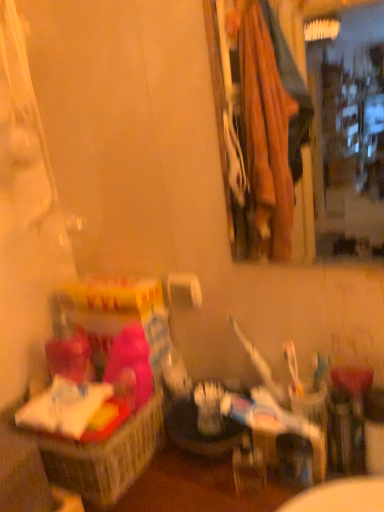
Image resolution: width=384 pixels, height=512 pixels. I want to click on white matte toilet paper at center, so click(184, 290).

Where is `wooden frame mirror at upper right`? The image size is (384, 512). wooden frame mirror at upper right is located at coordinates (332, 115).

Where is `pink fabric basket at left`? pink fabric basket at left is located at coordinates (104, 456).

Locate an element on the screen. mirror that is in front of the pink fabric basket at left is located at coordinates (332, 115).

Which is nearer, (40, 442) or (320, 99)?

Point (40, 442) is closer to the camera than point (320, 99).

From the image's perspective, which object appears higher, pink fabric basket at left or wooden frame mirror at upper right?

wooden frame mirror at upper right.

How different are the orientations of white matte toilet paper at center and wooden frame mirror at upper right in degrees?

The angular difference between white matte toilet paper at center and wooden frame mirror at upper right is 0.133 degrees.

From a real-world perspective, which is physically above, white matte toilet paper at center or wooden frame mirror at upper right?

wooden frame mirror at upper right, from a real-world perspective.

Is point (182, 281) closer or farther from the camera than point (342, 89)?

Point (182, 281).

Could you tell me if white matte toilet paper at center is facing wooden frame mirror at upper right?

No, white matte toilet paper at center is not oriented towards wooden frame mirror at upper right.

Is wooden frame mirror at upper right to the left or to the right of white matte toilet paper at center in the image?

In the image, wooden frame mirror at upper right appears on the right side of white matte toilet paper at center.

Which is behind, wooden frame mirror at upper right or white matte toilet paper at center?

white matte toilet paper at center is behind.

From the picture: Is wooden frame mirror at upper right wider than white matte toilet paper at center?

Indeed, wooden frame mirror at upper right has a greater width compared to white matte toilet paper at center.

Between point (336, 110) and point (172, 284), which one is positioned behind?

Positioned behind is point (336, 110).

How distant is wooden frame mirror at upper right from pink fabric basket at left?

The distance of wooden frame mirror at upper right from pink fabric basket at left is 5.26 meters.

Considering the relative sizes of wooden frame mirror at upper right and pink fabric basket at left in the image provided, is wooden frame mirror at upper right thinner than pink fabric basket at left?

Yes.

Who is taller, wooden frame mirror at upper right or pink fabric basket at left?

With more height is wooden frame mirror at upper right.

In the scene shown: Which is correct: wooden frame mirror at upper right is inside pink fabric basket at left, or outside of it?

The correct answer is: outside.

Is white matte toilet paper at center oriented away from pink fabric basket at left?

No.

How much distance is there between white matte toilet paper at center and pink fabric basket at left?

white matte toilet paper at center and pink fabric basket at left are 13.73 inches apart.

From the image's perspective, is white matte toilet paper at center above pink fabric basket at left?

Indeed, from the image's perspective, white matte toilet paper at center is shown above pink fabric basket at left.

Can you confirm if white matte toilet paper at center is positioned to the left of pink fabric basket at left?

No.

From the image's perspective, is pink fabric basket at left positioned above or below white matte toilet paper at center?

From the image's perspective, pink fabric basket at left appears below white matte toilet paper at center.

How many degrees apart are the facing directions of pink fabric basket at left and white matte toilet paper at center?

The angular difference between pink fabric basket at left and white matte toilet paper at center is 0.0997 degrees.

Is pink fabric basket at left taller than white matte toilet paper at center?

Indeed, pink fabric basket at left has a greater height compared to white matte toilet paper at center.

Would you say pink fabric basket at left is inside or outside white matte toilet paper at center?

pink fabric basket at left cannot be found inside white matte toilet paper at center.

Find the location of a particular element. Image resolution: width=384 pixels, height=512 pixels. mirror above the pink fabric basket at left (from a real-world perspective) is located at coordinates (332, 115).

This screenshot has height=512, width=384. What are the coordinates of `mirror in front of the white matte toilet paper at center` in the screenshot? It's located at (332, 115).

Estimate the real-world distances between objects in this image. Which object is closer to wooden frame mirror at upper right, pink fabric basket at left or white matte toilet paper at center?

Based on the image, white matte toilet paper at center appears to be nearer to wooden frame mirror at upper right.

Estimate the real-world distances between objects in this image. Which object is closer to pink fabric basket at left, white matte toilet paper at center or wooden frame mirror at upper right?

Based on the image, white matte toilet paper at center appears to be nearer to pink fabric basket at left.

Based on their spatial positions, is pink fabric basket at left or wooden frame mirror at upper right closer to white matte toilet paper at center?

pink fabric basket at left lies closer to white matte toilet paper at center than the other object.

Based on their spatial positions, is white matte toilet paper at center or pink fabric basket at left further from wooden frame mirror at upper right?

pink fabric basket at left lies further to wooden frame mirror at upper right than the other object.

When comparing their distances from white matte toilet paper at center, does wooden frame mirror at upper right or pink fabric basket at left seem further?

Among the two, wooden frame mirror at upper right is located further to white matte toilet paper at center.

Based on their spatial positions, is wooden frame mirror at upper right or white matte toilet paper at center further from pink fabric basket at left?

wooden frame mirror at upper right is further to pink fabric basket at left.

At what (x,y) coordinates should I click in order to perform the action: click on toilet paper between wooden frame mirror at upper right and pink fabric basket at left vertically. Please return your answer as a coordinate pair (x, y). The width and height of the screenshot is (384, 512). Looking at the image, I should click on [x=184, y=290].